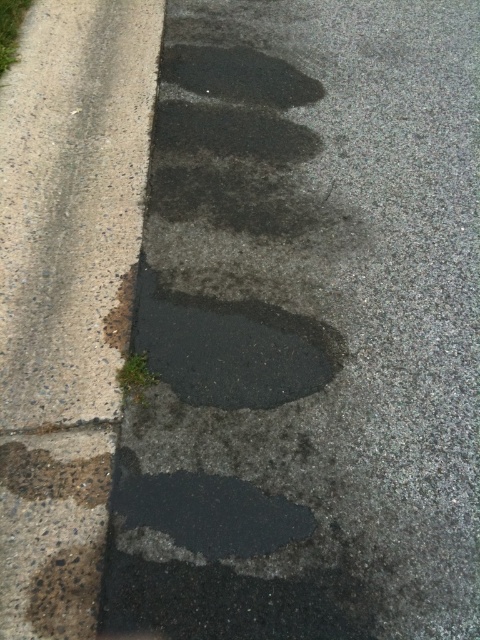
Question: Among these points, which one is nearest to the camera?

Choices:
 (A) (128, 340)
 (B) (108, 476)
 (C) (225, 67)
 (D) (216, 316)

Answer: (B)

Question: Is gray concrete curb at left in front of rusty metal footprint at lower left?

Choices:
 (A) yes
 (B) no

Answer: (A)

Question: Which object appears farthest from the camera in this image?

Choices:
 (A) black rubber footprint at center
 (B) black asphalt puddle at center

Answer: (A)

Question: Can you confirm if black rubber footprint at center is bigger than dark gray concrete at lower left?

Choices:
 (A) yes
 (B) no

Answer: (A)

Question: Estimate the real-world distances between objects in this image. Which object is closer to the brown textured footprint at lower left?

Choices:
 (A) black rubber footprint at center
 (B) black rubber footprint at lower center
 (C) dark gray asphalt crack at lower left
 (D) black asphalt puddle at center

Answer: (C)

Question: Is black rubber footprint at center below dark gray asphalt crack at lower left?

Choices:
 (A) yes
 (B) no

Answer: (B)